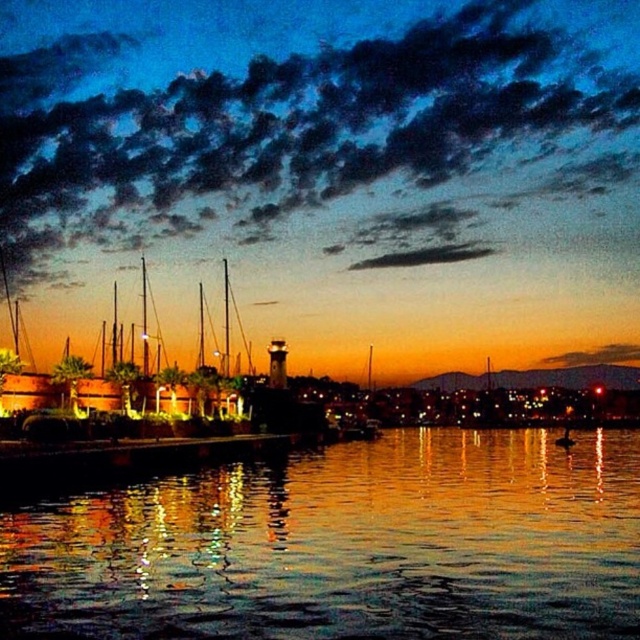
You are standing on the wooden dock at left and want to see the reflection of the sunset in the reflective glass water at center. Can you see the reflection clearly from your position?

The reflective glass water at center is below the wooden dock at left, so yes, you can see the reflection of the sunset in the reflective glass water at center from your position on the wooden dock at left.

You are a photographer planning to capture the harbor scene. You want to ensure that the wooden dock at left is wider in the photo than the reflective glass water at center. Based on the scene description, will this arrangement naturally occur?

The reflective glass water at center has a width less than the wooden dock at left, so yes, the wooden dock at left will naturally appear wider than the reflective glass water at center in the photo.

You are a delivery drone that needs to fly from the wooden dock at left to the reflective glass water at center. The drone has a maximum flight range of 150 feet. Can it make the trip without recharging?

The distance between the wooden dock at left and reflective glass water at center is 150.95 feet, which exceeds the drone maximum flight range of 150 feet. The drone cannot make the trip without recharging.